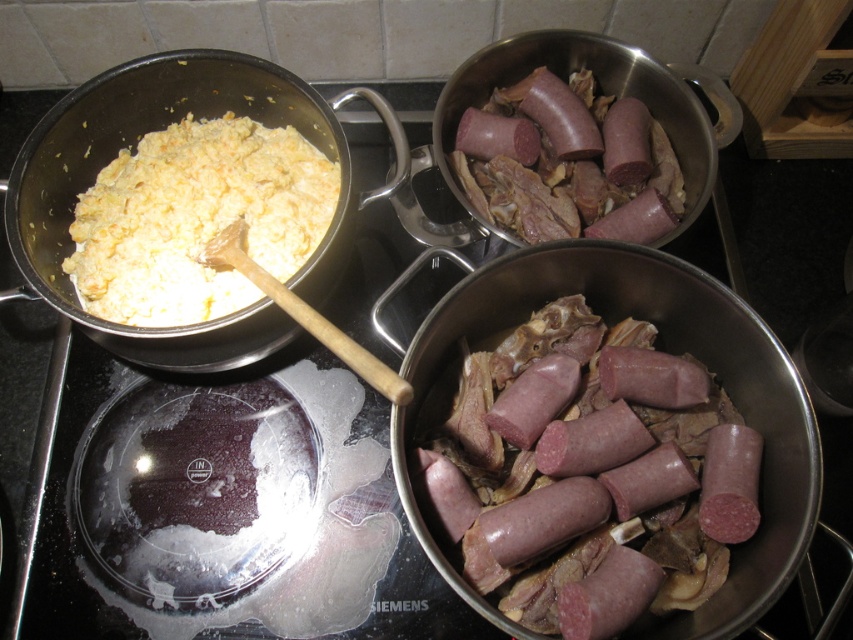
You are a chef preparing breakfast and see the purple glossy sausage at center and the purple glossy sausage at upper right on the stovetop. Which sausage is closer to the front of the stovetop?

The purple glossy sausage at upper right is closer to the front of the stovetop because the purple glossy sausage at center is positioned under it, indicating it is behind.

You are standing in front of the stovetop and want to grab the purple glossy sausage at center. Based on its coordinates, where exactly should you reach to pick it up?

The purple glossy sausage at center is located at coordinates point (585, 472), so you should reach to that exact point to pick it up.

You are a chef preparing a meal and need to move a bowl from the counter to the stovetop. The bowl is 8 inches wide. Is there enough space between the white creamy macaroni at upper left and the purple glossy sausage at upper right to place the bowl without disturbing the pots?

The distance between the white creamy macaroni at upper left and the purple glossy sausage at upper right is 10.53 inches. Since the bowl is 8 inches wide, there is sufficient space to place it between them without disturbing the pots.